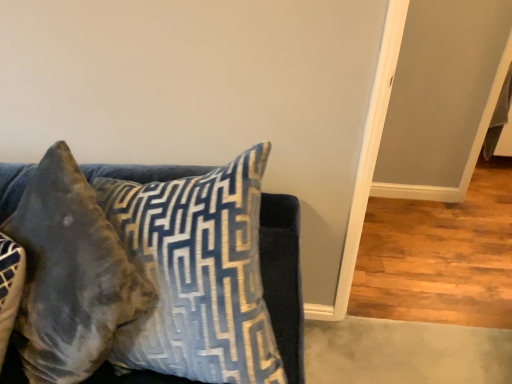
What do you see at coordinates (70, 274) in the screenshot?
I see `velvet brown pillow at left, the 1th pillow in the left-to-right sequence` at bounding box center [70, 274].

At what (x,y) coordinates should I click in order to perform the action: click on velvet brown pillow at left, acting as the 2th pillow starting from the right. Please return your answer as a coordinate pair (x, y). Looking at the image, I should click on (70, 274).

This screenshot has width=512, height=384. Describe the element at coordinates (197, 274) in the screenshot. I see `velvet blue pillow at upper left, the first pillow from the right` at that location.

Find the location of a particular element. This screenshot has height=384, width=512. velvet blue pillow at upper left, which ranks as the second pillow in left-to-right order is located at coordinates (197, 274).

The height and width of the screenshot is (384, 512). I want to click on velvet brown pillow at left, acting as the 2th pillow starting from the right, so click(x=70, y=274).

Considering the relative positions of velvet blue pillow at upper left, the first pillow from the right, and velvet brown pillow at left, the 1th pillow in the left-to-right sequence, in the image provided, is velvet blue pillow at upper left, the first pillow from the right, to the right of velvet brown pillow at left, the 1th pillow in the left-to-right sequence, from the viewer's perspective?

Correct, you'll find velvet blue pillow at upper left, the first pillow from the right, to the right of velvet brown pillow at left, the 1th pillow in the left-to-right sequence.

Which object is further away from the camera, velvet blue pillow at upper left, which ranks as the second pillow in left-to-right order, or velvet brown pillow at left, the 1th pillow in the left-to-right sequence?

velvet brown pillow at left, the 1th pillow in the left-to-right sequence, is more distant.

Which point is more forward, (151, 201) or (42, 236)?

The point (151, 201) is in front.

From the image's perspective, does velvet blue pillow at upper left, which ranks as the second pillow in left-to-right order, appear lower than velvet brown pillow at left, acting as the 2th pillow starting from the right?

Actually, velvet blue pillow at upper left, which ranks as the second pillow in left-to-right order, appears above velvet brown pillow at left, acting as the 2th pillow starting from the right, in the image.

From a real-world perspective, between velvet blue pillow at upper left, the first pillow from the right, and velvet brown pillow at left, the 1th pillow in the left-to-right sequence, who is vertically lower?

velvet brown pillow at left, the 1th pillow in the left-to-right sequence.

Considering the sizes of velvet blue pillow at upper left, the first pillow from the right, and velvet brown pillow at left, the 1th pillow in the left-to-right sequence, in the image, is velvet blue pillow at upper left, the first pillow from the right, wider or thinner than velvet brown pillow at left, the 1th pillow in the left-to-right sequence,?

Considering their sizes, velvet blue pillow at upper left, the first pillow from the right, looks broader than velvet brown pillow at left, the 1th pillow in the left-to-right sequence.

Considering the relative sizes of velvet blue pillow at upper left, the first pillow from the right, and velvet brown pillow at left, acting as the 2th pillow starting from the right, in the image provided, is velvet blue pillow at upper left, the first pillow from the right, taller than velvet brown pillow at left, acting as the 2th pillow starting from the right,?

Correct, velvet blue pillow at upper left, the first pillow from the right, is much taller as velvet brown pillow at left, acting as the 2th pillow starting from the right.

Can you confirm if velvet blue pillow at upper left, the first pillow from the right, is smaller than velvet brown pillow at left, acting as the 2th pillow starting from the right?

Yes, velvet blue pillow at upper left, the first pillow from the right, is smaller than velvet brown pillow at left, acting as the 2th pillow starting from the right.

Is velvet brown pillow at left, acting as the 2th pillow starting from the right, inside velvet blue pillow at upper left, which ranks as the second pillow in left-to-right order?

No, velvet brown pillow at left, acting as the 2th pillow starting from the right, is not a part of velvet blue pillow at upper left, which ranks as the second pillow in left-to-right order.

Is velvet blue pillow at upper left, which ranks as the second pillow in left-to-right order, far from velvet brown pillow at left, acting as the 2th pillow starting from the right?

velvet blue pillow at upper left, which ranks as the second pillow in left-to-right order, is actually quite close to velvet brown pillow at left, acting as the 2th pillow starting from the right.

Could you tell me if velvet blue pillow at upper left, which ranks as the second pillow in left-to-right order, is turned towards velvet brown pillow at left, acting as the 2th pillow starting from the right?

No, velvet blue pillow at upper left, which ranks as the second pillow in left-to-right order, is not facing towards velvet brown pillow at left, acting as the 2th pillow starting from the right.

How many degrees apart are the facing directions of velvet blue pillow at upper left, which ranks as the second pillow in left-to-right order, and velvet brown pillow at left, acting as the 2th pillow starting from the right?

The facing directions of velvet blue pillow at upper left, which ranks as the second pillow in left-to-right order, and velvet brown pillow at left, acting as the 2th pillow starting from the right, are 0.356 degrees apart.

This screenshot has height=384, width=512. In order to click on pillow located above the velvet brown pillow at left, the 1th pillow in the left-to-right sequence (from the image's perspective) in this screenshot , I will do click(x=197, y=274).

Does velvet brown pillow at left, acting as the 2th pillow starting from the right, appear on the left side of velvet blue pillow at upper left, which ranks as the second pillow in left-to-right order?

Yes.

Is velvet brown pillow at left, acting as the 2th pillow starting from the right, further to the viewer compared to velvet blue pillow at upper left, the first pillow from the right?

Yes, the depth of velvet brown pillow at left, acting as the 2th pillow starting from the right, is greater than that of velvet blue pillow at upper left, the first pillow from the right.

Is point (44, 371) farther from viewer compared to point (245, 274)?

Yes, it is.

From the image's perspective, is velvet brown pillow at left, acting as the 2th pillow starting from the right, located beneath velvet blue pillow at upper left, which ranks as the second pillow in left-to-right order?

Indeed, from the image's perspective, velvet brown pillow at left, acting as the 2th pillow starting from the right, is shown beneath velvet blue pillow at upper left, which ranks as the second pillow in left-to-right order.

From a real-world perspective, is velvet brown pillow at left, the 1th pillow in the left-to-right sequence, located beneath velvet blue pillow at upper left, the first pillow from the right?

Yes, from a real-world perspective, velvet brown pillow at left, the 1th pillow in the left-to-right sequence, is below velvet blue pillow at upper left, the first pillow from the right.

Between velvet brown pillow at left, the 1th pillow in the left-to-right sequence, and velvet blue pillow at upper left, the first pillow from the right, which one has smaller width?

With smaller width is velvet brown pillow at left, the 1th pillow in the left-to-right sequence.

Is velvet brown pillow at left, the 1th pillow in the left-to-right sequence, shorter than velvet blue pillow at upper left, the first pillow from the right?

Indeed, velvet brown pillow at left, the 1th pillow in the left-to-right sequence, has a lesser height compared to velvet blue pillow at upper left, the first pillow from the right.

Considering the sizes of objects velvet brown pillow at left, the 1th pillow in the left-to-right sequence, and velvet blue pillow at upper left, which ranks as the second pillow in left-to-right order, in the image provided, who is bigger, velvet brown pillow at left, the 1th pillow in the left-to-right sequence, or velvet blue pillow at upper left, which ranks as the second pillow in left-to-right order,?

velvet brown pillow at left, the 1th pillow in the left-to-right sequence.

Does velvet brown pillow at left, acting as the 2th pillow starting from the right, contain velvet blue pillow at upper left, the first pillow from the right?

No.

From the picture: Are velvet brown pillow at left, the 1th pillow in the left-to-right sequence, and velvet blue pillow at upper left, the first pillow from the right, beside each other?

velvet brown pillow at left, the 1th pillow in the left-to-right sequence, and velvet blue pillow at upper left, the first pillow from the right, are not in contact.

Is velvet brown pillow at left, the 1th pillow in the left-to-right sequence, facing towards velvet blue pillow at upper left, the first pillow from the right?

No.

At what (x,y) coordinates should I click in order to perform the action: click on pillow that appears below the velvet blue pillow at upper left, the first pillow from the right (from a real-world perspective). Please return your answer as a coordinate pair (x, y). This screenshot has height=384, width=512. Looking at the image, I should click on (70, 274).

Identify the location of pillow on the right side of velvet brown pillow at left, the 1th pillow in the left-to-right sequence. Image resolution: width=512 pixels, height=384 pixels. (197, 274).

This screenshot has height=384, width=512. In the image, there is a velvet blue pillow at upper left, which ranks as the second pillow in left-to-right order. Identify the location of pillow below it (from a real-world perspective). (70, 274).